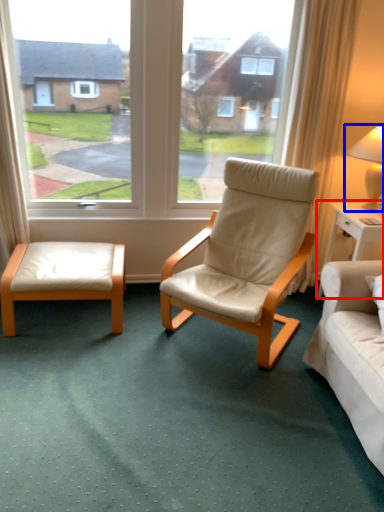
Question: Which of the following is the closest to the observer, nightstand (highlighted by a red box) or table lamp (highlighted by a blue box)?

Choices:
 (A) nightstand
 (B) table lamp

Answer: (B)